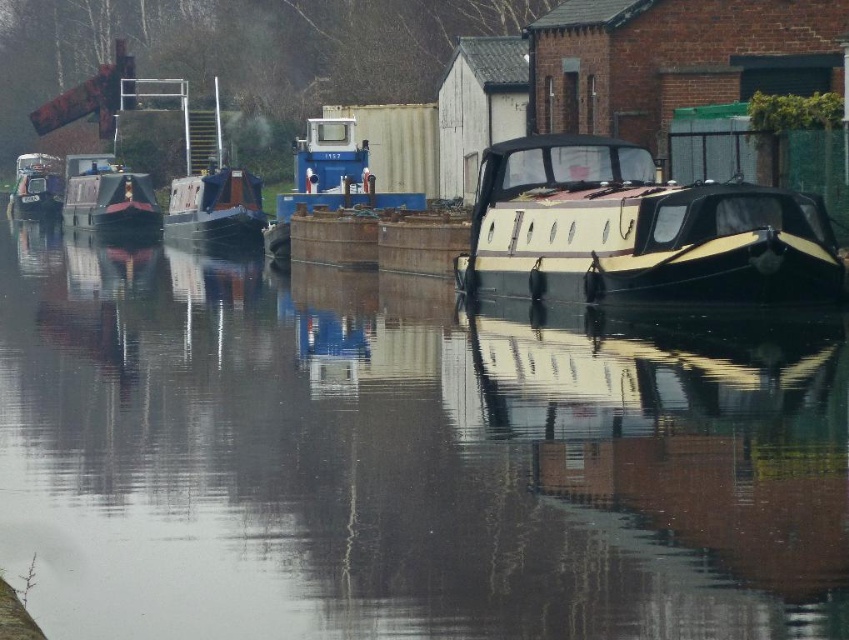
You are a photographer trying to capture the canal scene. You have two points of interest marked on your viewfinder at coordinates point (329, 333) and point (220, 212). Which point is closer to your camera lens?

Point (329, 333) is closer to the camera lens than point (220, 212).

You are standing at the point marked by the coordinates point (108, 196). Looking around, you see a shiny black boat at left. Which direction should you walk to reach the nearest industrial building?

The point (108, 196) marks the shiny black boat at left, so you are already at the boat. To reach the nearest industrial building, you should walk towards the buildings bordering the canal, likely in the direction away from the center towards the banks where the industrial structures are located.

You are a photographer planning to capture the glossy water at center and the matte black barge at center in a single shot. Based on their positions, which object should you frame first to ensure both are visible in the shot?

The matte black barge at center should be framed first since the glossy water at center is positioned on the right side of it, meaning the barge is to the left of the water. By centering the barge and adjusting the camera angle to include the water to its right, both elements can be captured in the frame.